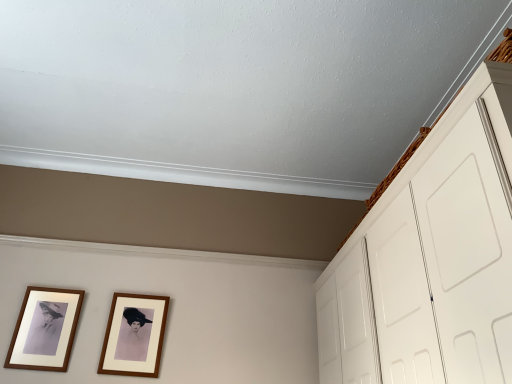
Question: Considering the positions of brown wooden picture frame at center, the first picture frame when ordered from right to left, and wooden framed photo at lower left, marked as the first picture frame in a left-to-right arrangement, in the image, is brown wooden picture frame at center, the first picture frame when ordered from right to left, taller or shorter than wooden framed photo at lower left, marked as the first picture frame in a left-to-right arrangement,?

Choices:
 (A) tall
 (B) short

Answer: (B)

Question: From the image's perspective, is brown wooden picture frame at center, the first picture frame when ordered from right to left, positioned above or below wooden framed photo at lower left, the 2th picture frame positioned from the right?

Choices:
 (A) above
 (B) below

Answer: (B)

Question: Based on their relative distances, which object is nearer to the brown wooden picture frame at center, positioned as the 2th picture frame in left-to-right order?

Choices:
 (A) wooden framed photo at lower left, marked as the first picture frame in a left-to-right arrangement
 (B) white matte cabinet at upper right

Answer: (A)

Question: Which object is the closest to the brown wooden picture frame at center, positioned as the 2th picture frame in left-to-right order?

Choices:
 (A) white matte cabinet at upper right
 (B) wooden framed photo at lower left, marked as the first picture frame in a left-to-right arrangement

Answer: (B)